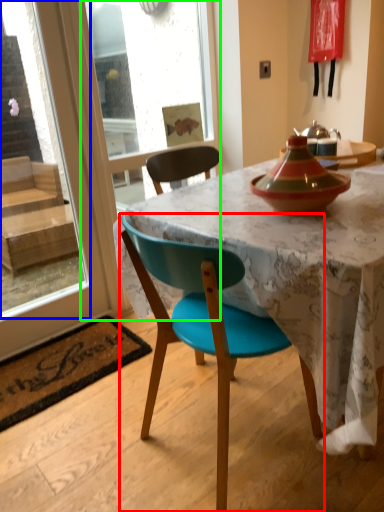
Question: Which is nearer to the chair (highlighted by a red box)? window screen (highlighted by a blue box) or screen door (highlighted by a green box).

Choices:
 (A) window screen
 (B) screen door

Answer: (B)